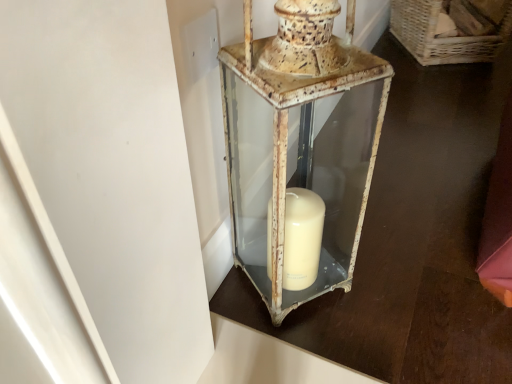
In order to click on free space in front of woven wicker basket at upper right in this screenshot , I will do `click(456, 96)`.